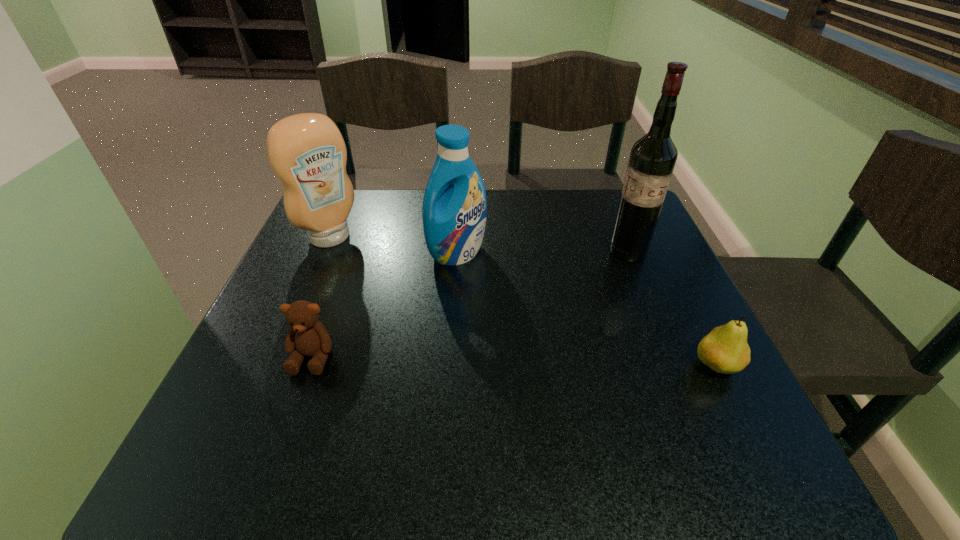
The height and width of the screenshot is (540, 960). I want to click on vacant space on the desktop that is between the teddy bear and the pear and is positioned on the front and back of the wine bottle, so click(540, 362).

In order to click on vacant spot on the desktop that is between the teddy bear and the pear and is positioned on the front-facing side of the detergent in this screenshot , I will do `click(571, 362)`.

Identify the location of free space on the desktop that is between the teddy bear and the pear and is positioned on the label of the condiment. (463, 360).